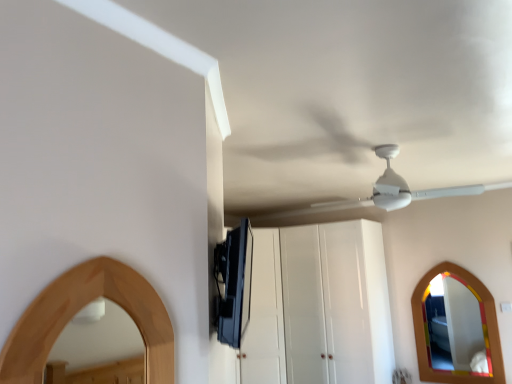
Question: Does white glossy cabinet at center have a greater height compared to wooden mirror at lower right?

Choices:
 (A) yes
 (B) no

Answer: (A)

Question: Considering the relative positions of white glossy cabinet at center and wooden mirror at lower right in the image provided, is white glossy cabinet at center to the left of wooden mirror at lower right from the viewer's perspective?

Choices:
 (A) no
 (B) yes

Answer: (B)

Question: From a real-world perspective, is white glossy cabinet at center located beneath wooden mirror at lower right?

Choices:
 (A) no
 (B) yes

Answer: (A)

Question: Does white glossy cabinet at center have a smaller size compared to wooden mirror at lower right?

Choices:
 (A) no
 (B) yes

Answer: (A)

Question: From the image's perspective, is white glossy cabinet at center on wooden mirror at lower right?

Choices:
 (A) yes
 (B) no

Answer: (A)

Question: Is white matte fan at upper center in front of or behind white glossy cabinet at center in the image?

Choices:
 (A) behind
 (B) front

Answer: (B)

Question: In the image, is white matte fan at upper center on the left side or the right side of white glossy cabinet at center?

Choices:
 (A) left
 (B) right

Answer: (B)

Question: Would you say white matte fan at upper center is inside or outside white glossy cabinet at center?

Choices:
 (A) inside
 (B) outside

Answer: (B)

Question: From the image's perspective, relative to white glossy cabinet at center, is white matte fan at upper center above or below?

Choices:
 (A) below
 (B) above

Answer: (B)

Question: Do you think satin black tv at upper center is within white matte fan at upper center, or outside of it?

Choices:
 (A) inside
 (B) outside

Answer: (B)

Question: In terms of height, does satin black tv at upper center look taller or shorter compared to white matte fan at upper center?

Choices:
 (A) tall
 (B) short

Answer: (A)

Question: Considering the positions of satin black tv at upper center and white matte fan at upper center in the image, is satin black tv at upper center bigger or smaller than white matte fan at upper center?

Choices:
 (A) big
 (B) small

Answer: (B)

Question: In the image, is satin black tv at upper center on the left side or the right side of white matte fan at upper center?

Choices:
 (A) right
 (B) left

Answer: (B)

Question: Visually, is white matte fan at upper center positioned to the left or to the right of wooden mirror at lower right?

Choices:
 (A) right
 (B) left

Answer: (B)

Question: In terms of height, does white matte fan at upper center look taller or shorter compared to wooden mirror at lower right?

Choices:
 (A) tall
 (B) short

Answer: (B)